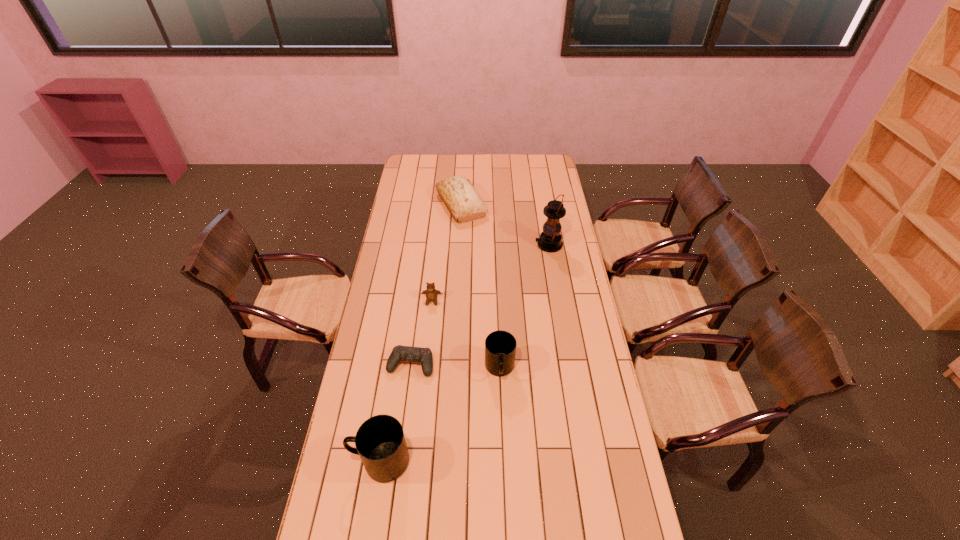
I want to click on vacant area in the image that satisfies the following two spatial constraints: 1. above the tallest object, indicating its light source; 2. at the face of the fifth tallest object, so click(x=558, y=301).